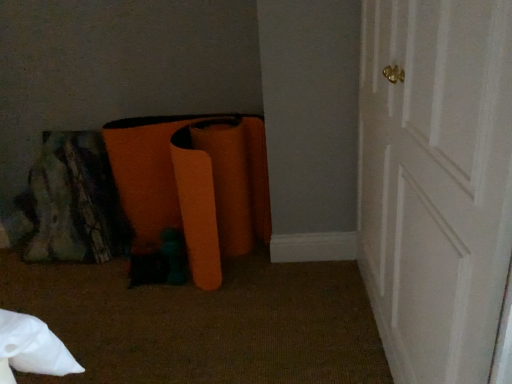
What is the approximate height of orange fabric bean bag at lower left?

25.10 inches.

This screenshot has width=512, height=384. What do you see at coordinates (182, 185) in the screenshot? I see `orange fabric bean bag at lower left` at bounding box center [182, 185].

You are a GUI agent. You are given a task and a screenshot of the screen. Output one action in this format:
    pyautogui.click(x=<x>, y=<y>)
    Task: Click on the orange fabric bean bag at lower left
    The height and width of the screenshot is (384, 512).
    Given the screenshot: What is the action you would take?
    pyautogui.click(x=182, y=185)

Identify the location of white wood door at right. (436, 182).

Describe the element at coordinates (436, 182) in the screenshot. I see `white wood door at right` at that location.

Measure the distance between white wood door at right and camera.

white wood door at right and camera are 49.67 centimeters apart from each other.

Locate an element on the screen. The image size is (512, 384). orange fabric bean bag at lower left is located at coordinates (182, 185).

Between white wood door at right and orange fabric bean bag at lower left, which one appears on the left side from the viewer's perspective?

orange fabric bean bag at lower left is more to the left.

Considering the relative positions of white wood door at right and orange fabric bean bag at lower left in the image provided, is white wood door at right in front of orange fabric bean bag at lower left?

Yes, it is in front of orange fabric bean bag at lower left.

Considering the points (478, 245) and (264, 191), which point is in front, point (478, 245) or point (264, 191)?

Positioned in front is point (478, 245).

From the image's perspective, does white wood door at right appear higher than orange fabric bean bag at lower left?

No, from the image's perspective, white wood door at right is not on top of orange fabric bean bag at lower left.

From a real-world perspective, is white wood door at right positioned over orange fabric bean bag at lower left based on gravity?

Correct, in the physical world, white wood door at right is higher than orange fabric bean bag at lower left.

Can you confirm if white wood door at right is thinner than orange fabric bean bag at lower left?

In fact, white wood door at right might be wider than orange fabric bean bag at lower left.

In terms of height, does white wood door at right look taller or shorter compared to orange fabric bean bag at lower left?

white wood door at right is taller than orange fabric bean bag at lower left.

Considering the sizes of white wood door at right and orange fabric bean bag at lower left in the image, is white wood door at right bigger or smaller than orange fabric bean bag at lower left?

Considering their sizes, white wood door at right takes up more space than orange fabric bean bag at lower left.

Is white wood door at right not within orange fabric bean bag at lower left?

Absolutely, white wood door at right is external to orange fabric bean bag at lower left.

Is white wood door at right far from orange fabric bean bag at lower left?

No, white wood door at right is not far from orange fabric bean bag at lower left.

Is white wood door at right oriented away from orange fabric bean bag at lower left?

No, white wood door at right's orientation is not away from orange fabric bean bag at lower left.

How different are the orientations of white wood door at right and orange fabric bean bag at lower left in degrees?

The facing directions of white wood door at right and orange fabric bean bag at lower left are 89.1 degrees apart.

Where is `bean bag chair behind the white wood door at right`? This screenshot has height=384, width=512. bean bag chair behind the white wood door at right is located at coordinates (182, 185).

Is orange fabric bean bag at lower left at the left side of white wood door at right?

Correct, you'll find orange fabric bean bag at lower left to the left of white wood door at right.

Which object is closer to the camera, orange fabric bean bag at lower left or white wood door at right?

Positioned in front is white wood door at right.

Is point (210, 164) in front of point (414, 176)?

That is False.

From the image's perspective, is orange fabric bean bag at lower left above white wood door at right?

Yes, from the image's perspective, orange fabric bean bag at lower left is on top of white wood door at right.

From a real-world perspective, which is physically above, orange fabric bean bag at lower left or white wood door at right?

white wood door at right.

Considering the relative sizes of orange fabric bean bag at lower left and white wood door at right in the image provided, is orange fabric bean bag at lower left thinner than white wood door at right?

Yes, orange fabric bean bag at lower left is thinner than white wood door at right.

Looking at this image, who is taller, orange fabric bean bag at lower left or white wood door at right?

white wood door at right.

Between orange fabric bean bag at lower left and white wood door at right, which one has larger size?

Bigger between the two is white wood door at right.

Consider the image. Can we say orange fabric bean bag at lower left lies outside white wood door at right?

Yes, orange fabric bean bag at lower left is not within white wood door at right.

Would you consider orange fabric bean bag at lower left to be distant from white wood door at right?

No, orange fabric bean bag at lower left is in close proximity to white wood door at right.

Is white wood door at right at the back of orange fabric bean bag at lower left?

No, orange fabric bean bag at lower left's orientation is not away from white wood door at right.

I want to click on bean bag chair below the white wood door at right (from a real-world perspective), so click(182, 185).

Where is `bean bag chair on the left of the white wood door at right`? bean bag chair on the left of the white wood door at right is located at coordinates (182, 185).

This screenshot has width=512, height=384. I want to click on door lying on the right of orange fabric bean bag at lower left, so click(x=436, y=182).